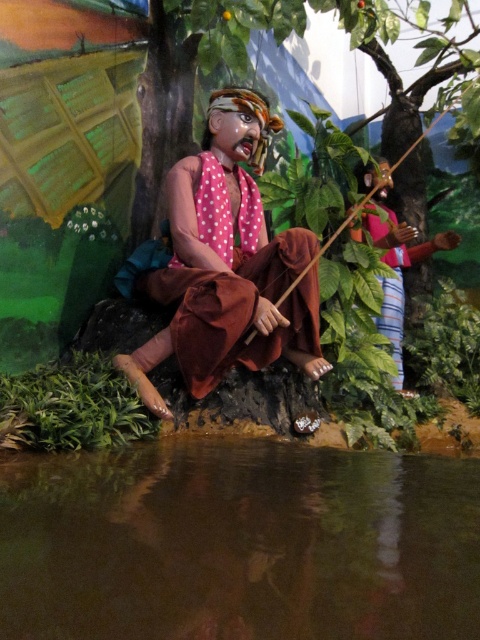
Looking at this image, which is above, transparent liquid water at lower center or matte brown cloth at center?

matte brown cloth at center is above.

Find the location of a particular element. The width and height of the screenshot is (480, 640). transparent liquid water at lower center is located at coordinates (239, 544).

You are a GUI agent. You are given a task and a screenshot of the screen. Output one action in this format:
    pyautogui.click(x=<x>, y=<y>)
    Task: Click on the transparent liquid water at lower center
    This screenshot has width=480, height=640.
    Given the screenshot: What is the action you would take?
    pyautogui.click(x=239, y=544)

Identify the location of transparent liquid water at lower center. This screenshot has height=640, width=480. (239, 544).

How much distance is there between transparent liquid water at lower center and polka dot fabric shirt at upper right?

The distance of transparent liquid water at lower center from polka dot fabric shirt at upper right is 2.70 meters.

Can you confirm if transparent liquid water at lower center is thinner than polka dot fabric shirt at upper right?

No, transparent liquid water at lower center is not thinner than polka dot fabric shirt at upper right.

Identify the location of transparent liquid water at lower center. The image size is (480, 640). (239, 544).

The height and width of the screenshot is (640, 480). I want to click on transparent liquid water at lower center, so click(239, 544).

Is matte brown cloth at center below polka dot fabric shirt at upper right?

Indeed, matte brown cloth at center is positioned under polka dot fabric shirt at upper right.

Does matte brown cloth at center have a lesser width compared to polka dot fabric shirt at upper right?

Incorrect, matte brown cloth at center's width is not less than polka dot fabric shirt at upper right's.

Is point (230, 257) behind point (404, 257)?

No.

This screenshot has height=640, width=480. What are the coordinates of `matte brown cloth at center` in the screenshot? It's located at (228, 264).